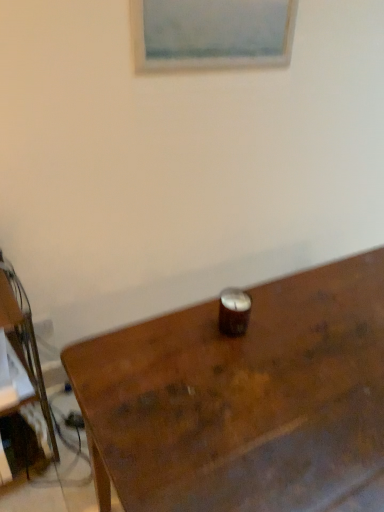
Question: Is point (8, 424) positioned closer to the camera than point (218, 18)?

Choices:
 (A) closer
 (B) farther

Answer: (A)

Question: From the image's perspective, is brown wooden desk at left positioned above or below matte white picture frame at upper center?

Choices:
 (A) above
 (B) below

Answer: (B)

Question: Estimate the real-world distances between objects in this image. Which object is farther from the matte white picture frame at upper center?

Choices:
 (A) brown wooden desk at left
 (B) wooden table at center

Answer: (A)

Question: Which object is positioned closest to the brown wooden desk at left?

Choices:
 (A) matte white picture frame at upper center
 (B) wooden table at center

Answer: (B)